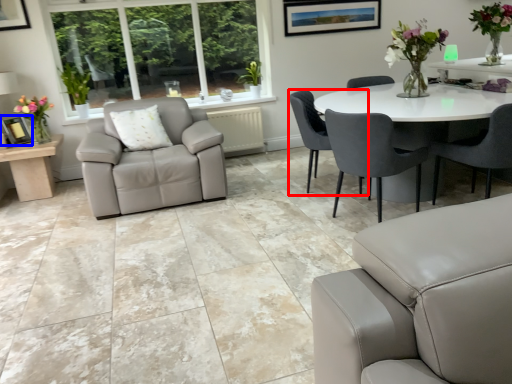
Question: Among these objects, which one is farthest to the camera, chair (highlighted by a red box) or picture frame (highlighted by a blue box)?

Choices:
 (A) chair
 (B) picture frame

Answer: (B)